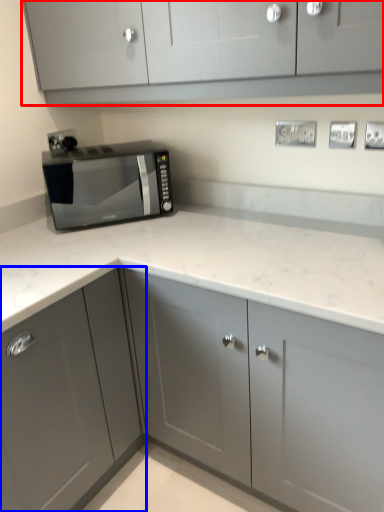
Question: Which point is further to the camera, cabinetry (highlighted by a red box) or cabinetry (highlighted by a blue box)?

Choices:
 (A) cabinetry
 (B) cabinetry

Answer: (B)